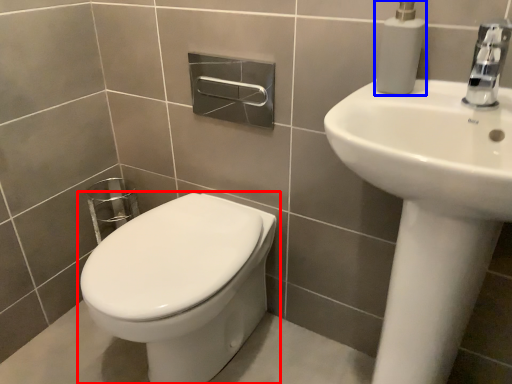
Question: Which of the following is the closest to the observer, toilet (highlighted by a red box) or soap dispenser (highlighted by a blue box)?

Choices:
 (A) toilet
 (B) soap dispenser

Answer: (B)